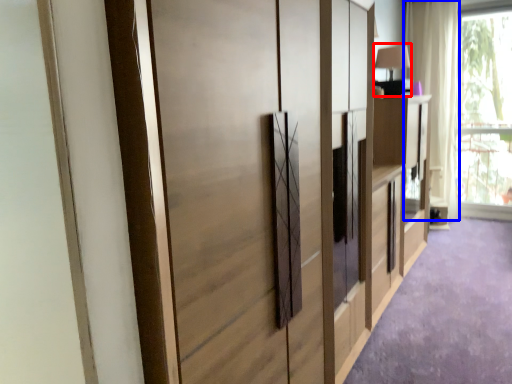
Question: Which object is closer to the camera taking this photo, table lamp (highlighted by a red box) or curtain (highlighted by a blue box)?

Choices:
 (A) table lamp
 (B) curtain

Answer: (A)